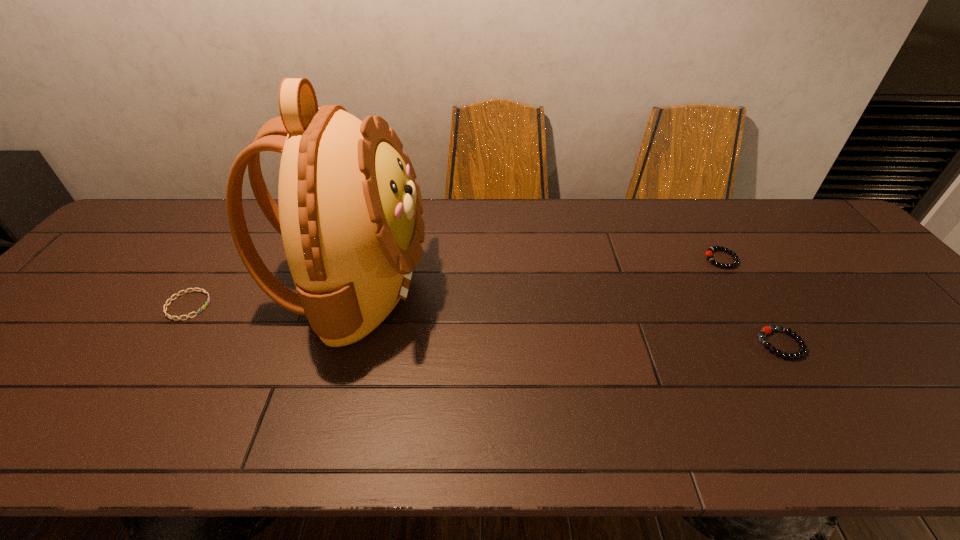
Identify the location of free spot between the leftmost bracelet and the nearest bracelet. This screenshot has width=960, height=540. (485, 325).

This screenshot has height=540, width=960. I want to click on the closest object relative to the farthest bracelet, so click(x=765, y=330).

Point out which object is positioned as the third nearest to the nearest bracelet. Please provide its 2D coordinates. Your answer should be formatted as a tuple, i.e. [(x, y)], where the tuple contains the x and y coordinates of a point satisfying the conditions above.

[(202, 290)]

This screenshot has width=960, height=540. In order to click on the second closest bracelet relative to the farthest bracelet in this screenshot , I will do pyautogui.click(x=202, y=290).

Locate which bracelet is the second closest to the farthest bracelet. Please provide its 2D coordinates. Your answer should be formatted as a tuple, i.e. [(x, y)], where the tuple contains the x and y coordinates of a point satisfying the conditions above.

[(202, 290)]

This screenshot has height=540, width=960. What are the coordinates of `free space that satisfies the following two spatial constraints: 1. on the surface of the nearest bracelet showing star-shaped elements; 2. on the right side of the second nearest bracelet` in the screenshot? It's located at (163, 344).

Identify the location of vacant area in the image that satisfies the following two spatial constraints: 1. on the surface of the nearest bracelet showing star-shaped elements; 2. on the left side of the leftmost object. The height and width of the screenshot is (540, 960). (163, 344).

Where is `free location that satisfies the following two spatial constraints: 1. on the front-facing side of the backpack; 2. on the right side of the nearest bracelet`? This screenshot has height=540, width=960. free location that satisfies the following two spatial constraints: 1. on the front-facing side of the backpack; 2. on the right side of the nearest bracelet is located at coordinates (337, 344).

At what (x,y) coordinates should I click in order to perform the action: click on free region that satisfies the following two spatial constraints: 1. on the surface of the nearest bracelet showing star-shaped elements; 2. on the left side of the leftmost object. Please return your answer as a coordinate pair (x, y). Looking at the image, I should click on (163, 344).

Find the location of `vacant space that satisfies the following two spatial constraints: 1. on the surface of the second farthest bracelet showing star-shaped elements; 2. on the left side of the nearest bracelet`. vacant space that satisfies the following two spatial constraints: 1. on the surface of the second farthest bracelet showing star-shaped elements; 2. on the left side of the nearest bracelet is located at coordinates (163, 344).